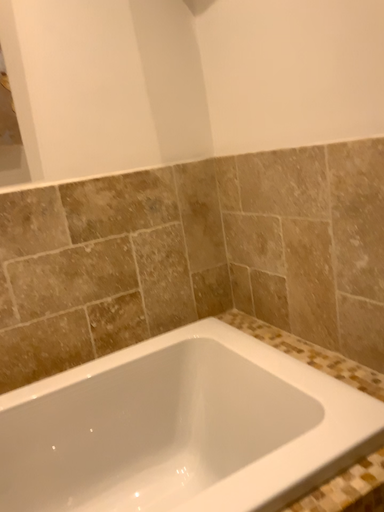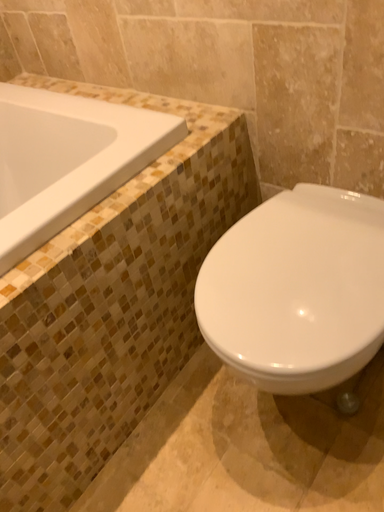
Question: Which way did the camera rotate in the video?

Choices:
 (A) rotated right
 (B) rotated left

Answer: (A)